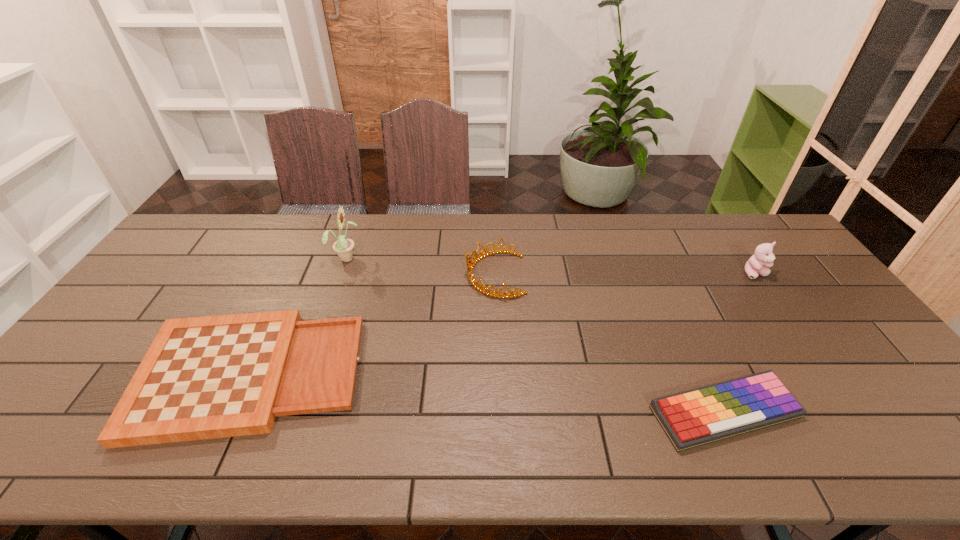
At what (x,y) coordinates should I click in order to perform the action: click on the tallest object. Please return your answer as a coordinate pair (x, y). The image size is (960, 540). Looking at the image, I should click on (343, 246).

Image resolution: width=960 pixels, height=540 pixels. What are the coordinates of `the second tallest object` in the screenshot? It's located at (763, 256).

The width and height of the screenshot is (960, 540). In order to click on the rightmost object in this screenshot , I will do pos(763,256).

I want to click on the third shortest object, so click(x=470, y=264).

Find the location of a particular element. the third object from right to left is located at coordinates (470, 264).

The width and height of the screenshot is (960, 540). Identify the location of computer keyboard. (700, 416).

The height and width of the screenshot is (540, 960). In order to click on gameboard in this screenshot , I will do `click(209, 377)`.

Where is `free location located on the front-facing side of the tallest object`? This screenshot has width=960, height=540. free location located on the front-facing side of the tallest object is located at coordinates (430, 257).

Where is `vacant region located at the face of the teddy bear`? This screenshot has height=540, width=960. vacant region located at the face of the teddy bear is located at coordinates (833, 386).

The width and height of the screenshot is (960, 540). Find the location of `free region located 0.090m on the front-facing side of the third object from left to right`. free region located 0.090m on the front-facing side of the third object from left to right is located at coordinates (437, 274).